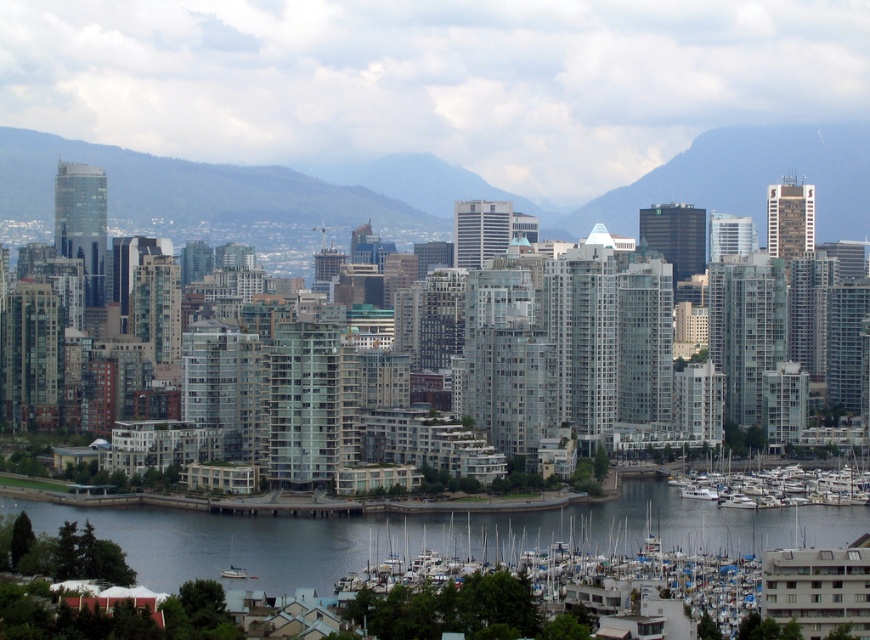
In the scene shown: Does green forested mountain at upper center appear over white glossy boats at lower right?

Yes, green forested mountain at upper center is above white glossy boats at lower right.

Does point (733, 173) lie behind point (704, 492)?

Yes, point (733, 173) is farther from viewer.

Where is `green forested mountain at upper center`? Image resolution: width=870 pixels, height=640 pixels. green forested mountain at upper center is located at coordinates (748, 179).

Which is above, transparent water at lower center or white matte boats at lower right?

transparent water at lower center

What do you see at coordinates (225, 544) in the screenshot?
I see `transparent water at lower center` at bounding box center [225, 544].

Is point (805, 529) positioned after point (494, 614)?

Yes, it is.

I want to click on transparent water at lower center, so click(x=225, y=544).

Does point (781, 506) come in front of point (623, 188)?

That is False.

Is transparent water at lower center thinner than green forested mountain at upper center?

No, transparent water at lower center is not thinner than green forested mountain at upper center.

Looking at this image, measure the distance between transparent water at lower center and camera.

A distance of 2141.07 feet exists between transparent water at lower center and camera.

Locate an element on the screen. transparent water at lower center is located at coordinates (225, 544).